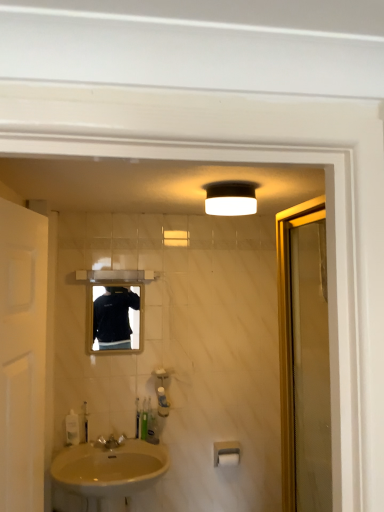
Find the location of `vacant area that is in front of translucent plastic soap dispenser at lower left`. vacant area that is in front of translucent plastic soap dispenser at lower left is located at coordinates (74, 451).